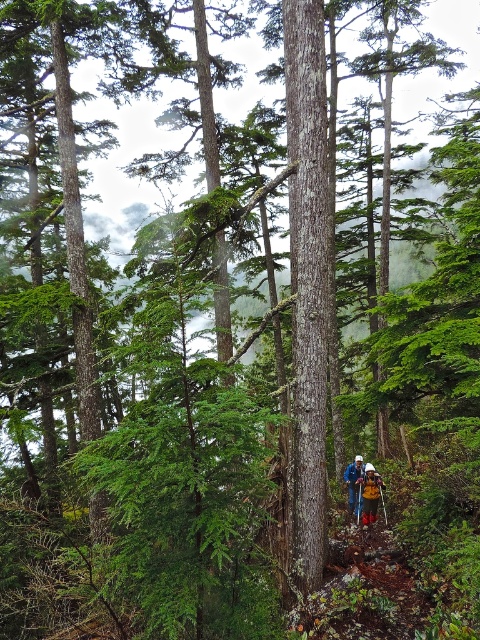
You are a hiker planning to carry both the yellow fabric backpack at center and the camouflage jacket at lower center. If you want to place them side by side on a narrow ledge, which one should you place first to ensure both fit?

The yellow fabric backpack at center is wider than the camouflage jacket at lower center. To fit both on the narrow ledge, place the wider yellow fabric backpack at center first, then the narrower camouflage jacket at lower center next to it.

You are planning to carry both the yellow fabric backpack at center and the camouflage jacket at lower center during your hike. Based on their sizes, which one can you easily fit into the other?

The yellow fabric backpack at center is smaller than the camouflage jacket at lower center, so the yellow fabric backpack at center can easily fit into the camouflage jacket at lower center.